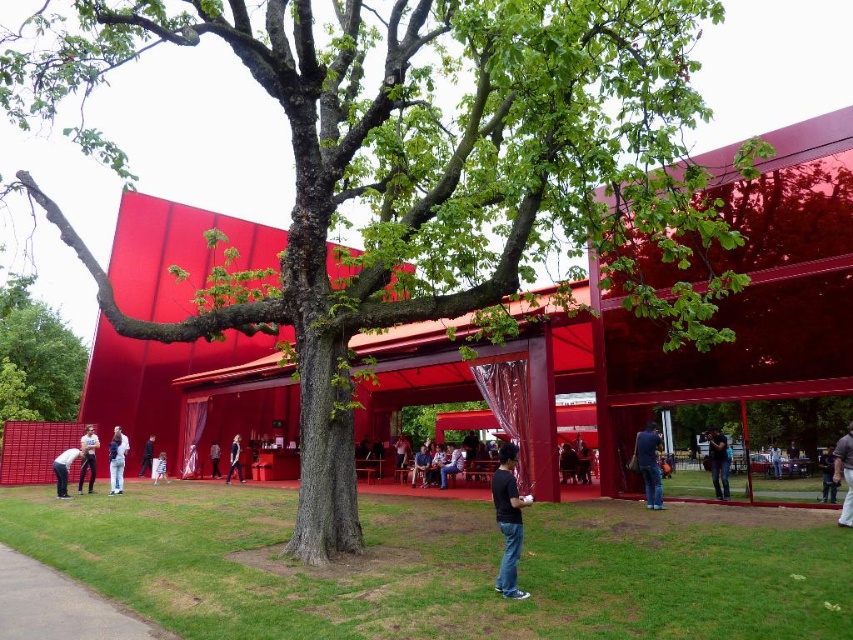
You are standing at the base of the green leafy tree at center. You want to throw a ball to your friend who is standing 10 meters away from you in the direction of the red building. Will the red building block your throw?

The green leafy tree at center and viewer are 9.20 meters apart. Since your friend is 10 meters away from you, the red building is further away than the distance to your friend. Therefore, the red building will not block your throw.

You are standing at the center of the image and want to pick up the white cotton shirt at lower left. Which direction should you move to reach it?

The white cotton shirt at lower left is located at point 0.719 on the x axis and 0.138 on the y axis. Since you are at the center, you should move to the right and down to reach it.